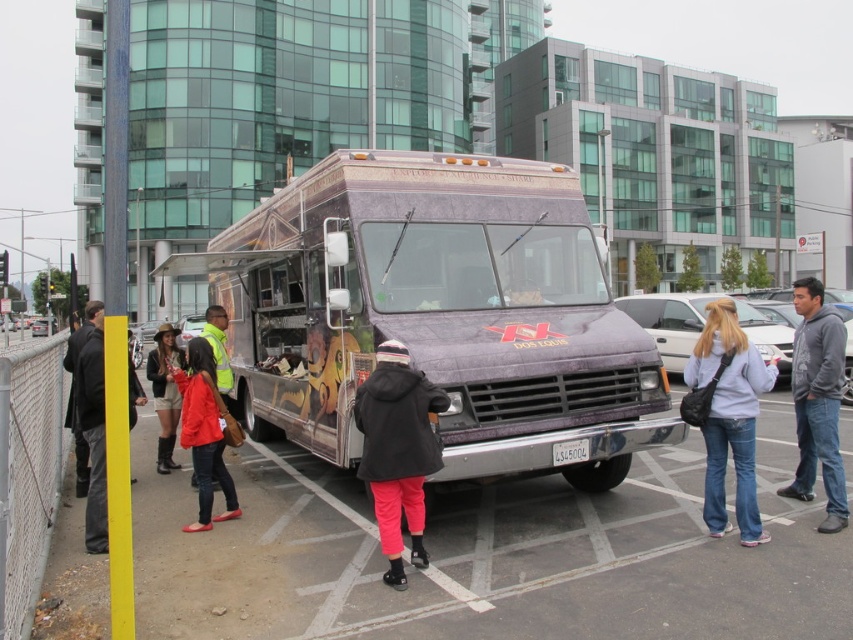
Question: Can you confirm if matte red jacket at lower left is positioned below denim jacket at lower left?

Choices:
 (A) no
 (B) yes

Answer: (A)

Question: Among these objects, which one is farthest from the camera?

Choices:
 (A) black matte coat at center
 (B) yellow matte pole at left
 (C) gray hoodie at right

Answer: (B)

Question: Which point is closer to the camera?

Choices:
 (A) (149, 353)
 (B) (204, 480)

Answer: (B)

Question: In this image, where is matte purple van at center located relative to gray hoodie at right?

Choices:
 (A) below
 (B) above

Answer: (B)

Question: Does matte red jacket at lower left have a lesser width compared to yellow matte pole at left?

Choices:
 (A) no
 (B) yes

Answer: (A)

Question: Which of the following is the closest to the observer?

Choices:
 (A) denim jacket at lower left
 (B) black matte coat at center
 (C) gray hoodie at right

Answer: (B)